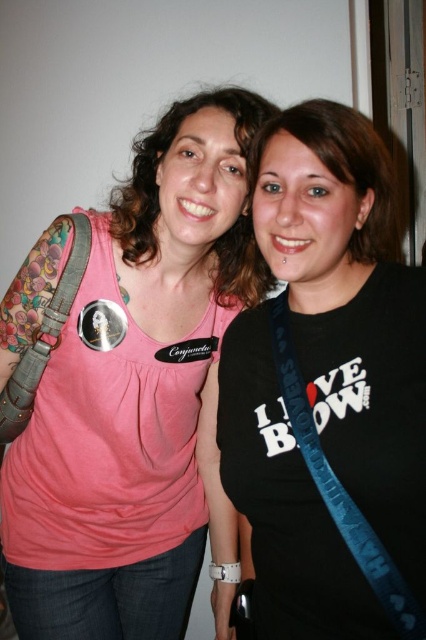
Question: Which of these objects is positioned closest to the matte black shirt at center?

Choices:
 (A) blue fabric strap at right
 (B) black matte shirt at center
 (C) pink fabric tank top at center

Answer: (B)

Question: Is matte black shirt at center positioned before blue fabric strap at right?

Choices:
 (A) yes
 (B) no

Answer: (B)

Question: Which object is closer to the camera taking this photo?

Choices:
 (A) black matte t-shirt at center
 (B) matte black shirt at center
 (C) leather strap at left
 (D) blue fabric strap at right

Answer: (A)

Question: Where is black matte t-shirt at center located in relation to blue fabric strap at right in the image?

Choices:
 (A) below
 (B) above

Answer: (B)

Question: Does black matte shirt at center have a lesser width compared to leather strap at left?

Choices:
 (A) yes
 (B) no

Answer: (B)

Question: Which object is positioned farthest from the black matte shirt at center?

Choices:
 (A) blue fabric strap at right
 (B) leather strap at left
 (C) pink fabric tank top at center

Answer: (B)